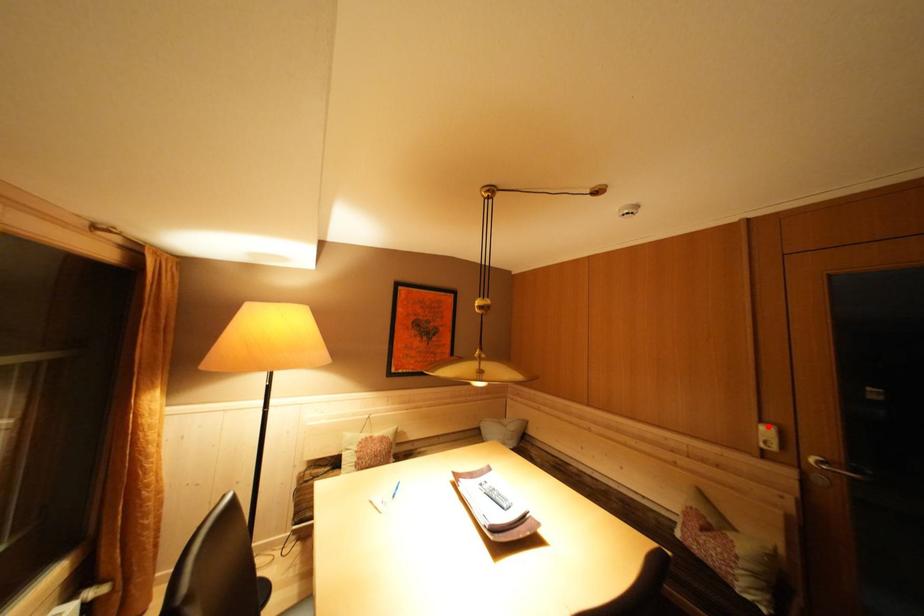
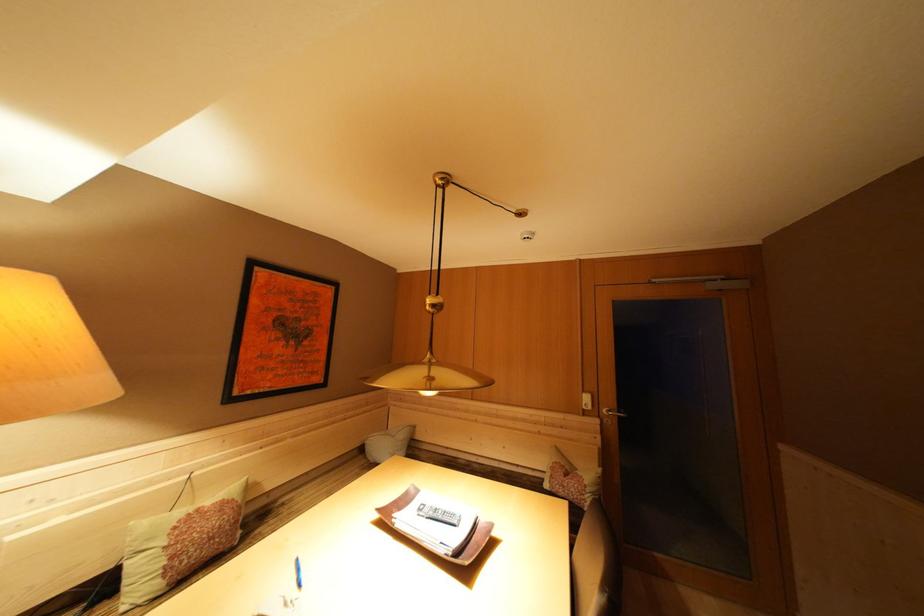
Find the pixel in the second image that matches the highlighted location in the first image.

(590, 397)